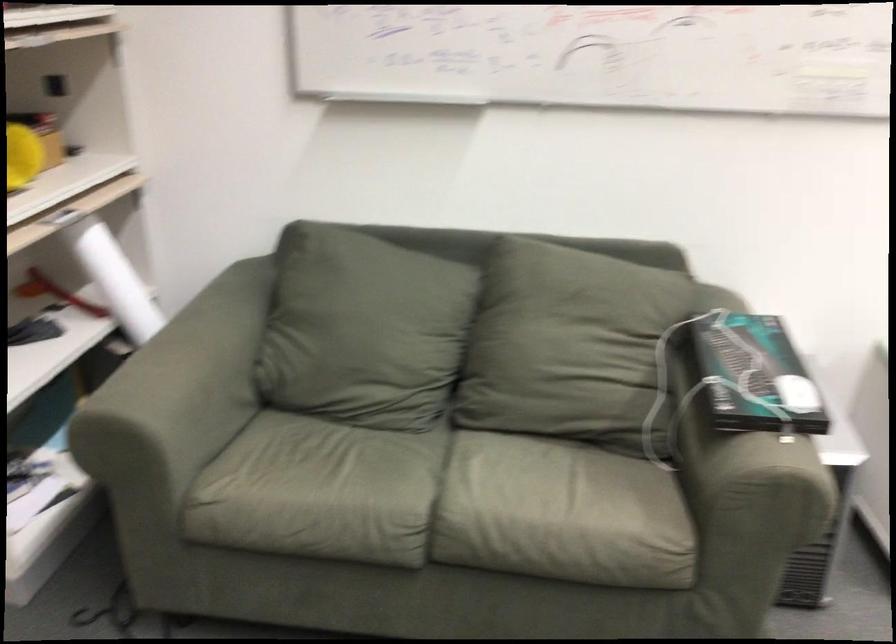
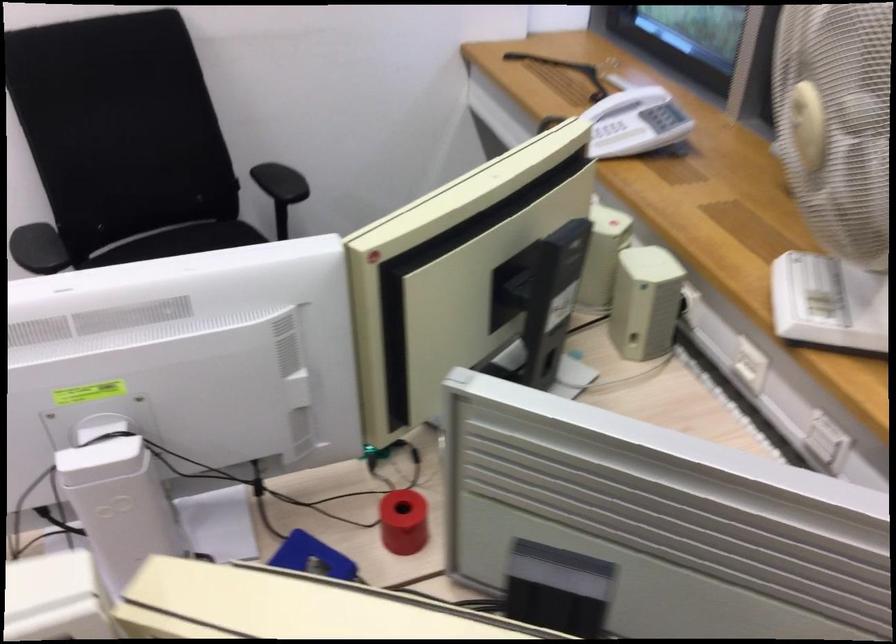
Question: Which direction would the cameraman need to move to produce the second image? Reply with the corresponding letter.

Choices:
 (A) Left
 (B) Right
 (C) Forward
 (D) Backward

Answer: (B)